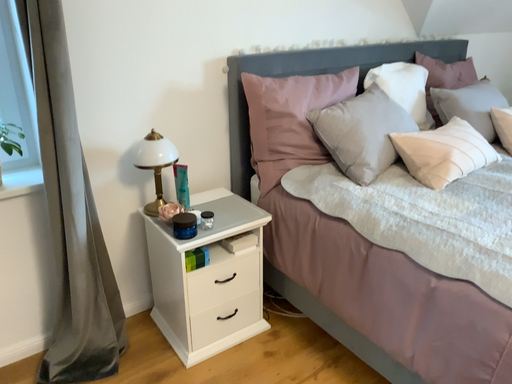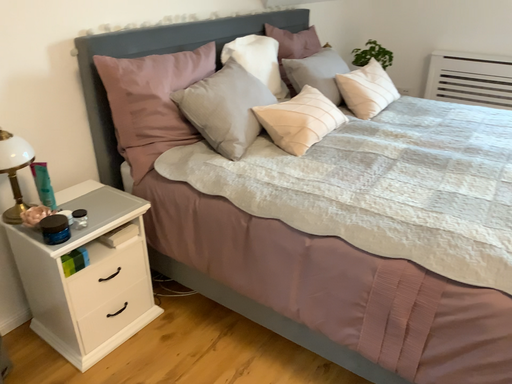
Question: Which way did the camera rotate in the video?

Choices:
 (A) rotated right
 (B) rotated left

Answer: (A)